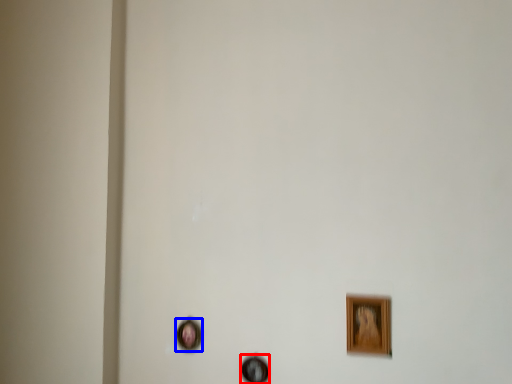
Question: Among these objects, which one is nearest to the camera, picture frame (highlighted by a red box) or picture frame (highlighted by a blue box)?

Choices:
 (A) picture frame
 (B) picture frame

Answer: (A)